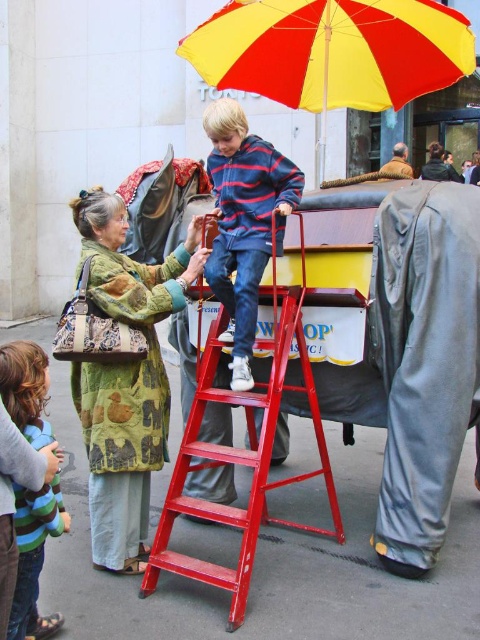
You are a drone operator trying to capture a photo of the child and the elephant. The yellow fabric umbrella at upper center is blocking your view. Can you adjust your position to avoid it?

The yellow fabric umbrella at upper center is located at point (333, 51). To avoid it, move the drone to a position that is not at those coordinates, such as slightly to the left or right of the umbrella.